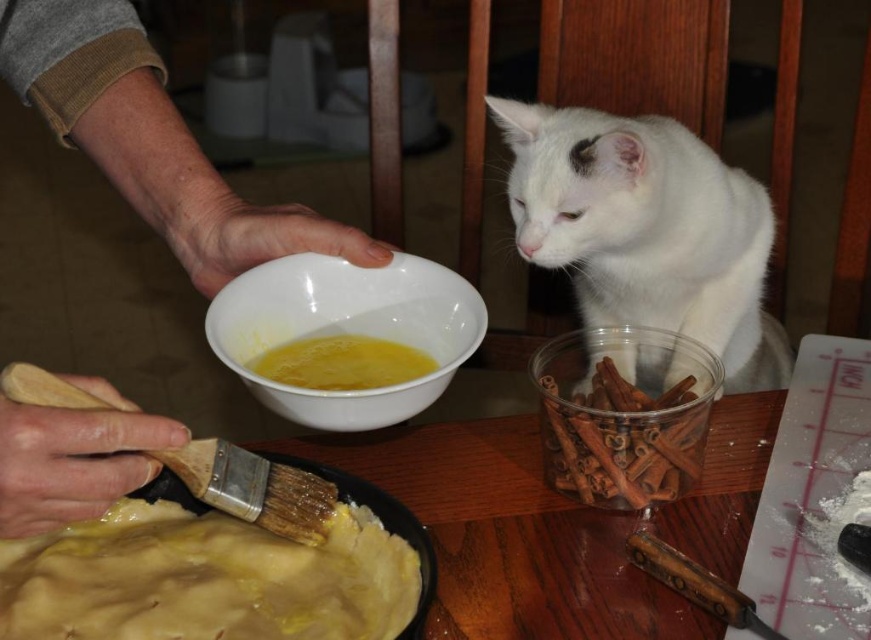
Question: Which point is farther to the camera?

Choices:
 (A) wooden hand at upper left
 (B) white ceramic bowl at center
 (C) wooden bristles at lower left
 (D) white fluffy cat at upper right

Answer: (D)

Question: Can you confirm if brown translucent plastic container at lower right is positioned to the right of yellow liquid at center?

Choices:
 (A) yes
 (B) no

Answer: (A)

Question: Among these objects, which one is nearest to the camera?

Choices:
 (A) yellow liquid at center
 (B) brown translucent plastic container at lower right
 (C) white ceramic bowl at center
 (D) wooden hand at upper left

Answer: (D)

Question: Which of the following is the farthest from the observer?

Choices:
 (A) (404, 608)
 (B) (561, 461)
 (C) (545, 264)
 (D) (242, 509)

Answer: (C)

Question: Can you confirm if wooden hand at upper left is positioned below brown translucent plastic container at lower right?

Choices:
 (A) yes
 (B) no

Answer: (B)

Question: Does yellow matte pie crust at lower left have a larger size compared to wooden bristles at lower left?

Choices:
 (A) yes
 (B) no

Answer: (B)